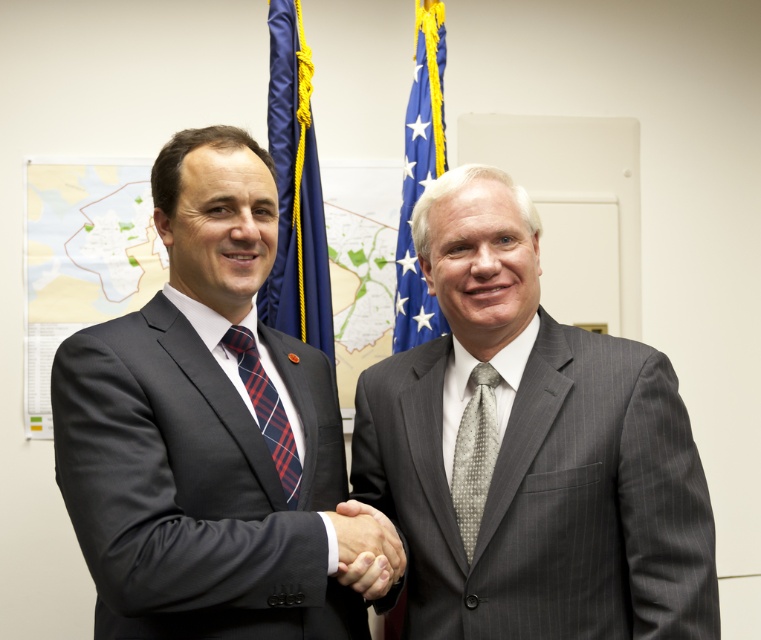
You are a guest at a professional event and want to approach the two men shaking hands. Which flag, the blue fabric flag at left or the blue fabric flag at upper center, is closer to you as you enter the room?

The blue fabric flag at left is closer to the viewer than the blue fabric flag at upper center, so the blue fabric flag at left is closer to you as you enter the room.

You are standing in the professional setting where two men are shaking hands. You notice the blue fabric flag at left. Can you determine its exact position relative to the men based on the coordinates provided?

The blue fabric flag at left is located at point coordinates (295, 189), which places it to the left side of the scene, slightly above the center.

You are a photographer trying to capture the handshake between the two men in the scene. Since the gray pinstripe suit at center is partially blocking the view, will you need to adjust your position to see the smooth skin handshake at center clearly?

The smooth skin handshake at center is behind gray pinstripe suit at center, so the photographer will need to adjust their position to see the handshake clearly as it is currently obscured by the suit.